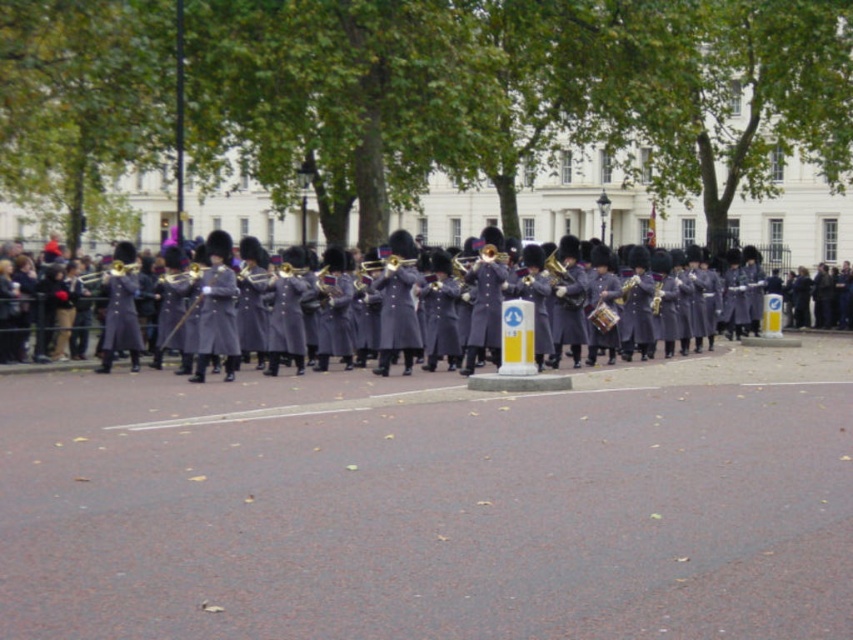
Question: Which point is farther to the camera?

Choices:
 (A) (196, 300)
 (B) (94, 280)

Answer: (B)

Question: Is matte gray uniform at center bigger than matte gold trumpet at center?

Choices:
 (A) no
 (B) yes

Answer: (B)

Question: Is matte gray uniform at center positioned before matte gold trumpet at center?

Choices:
 (A) yes
 (B) no

Answer: (A)

Question: From the image, what is the correct spatial relationship of matte gray uniform at center in relation to matte gold trumpet at center?

Choices:
 (A) above
 (B) below

Answer: (B)